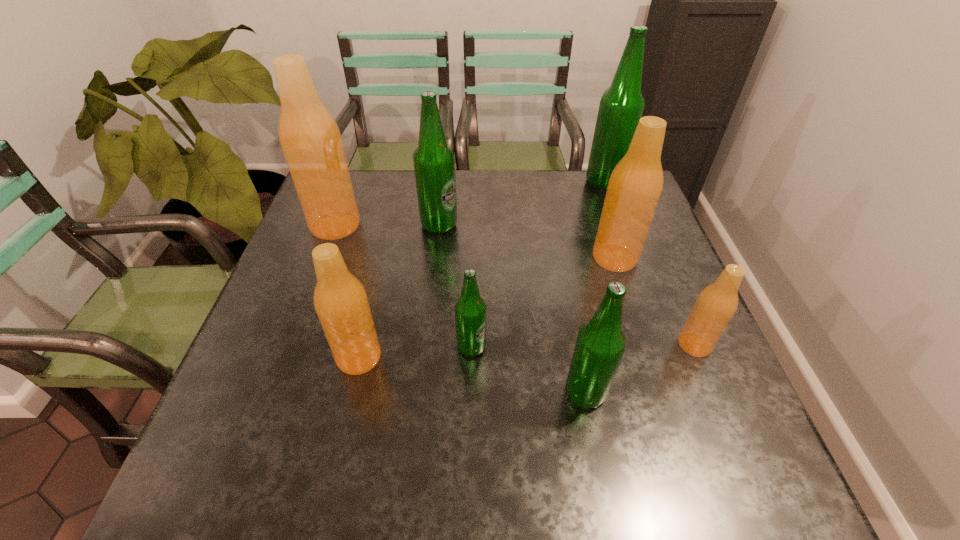
Where is `vacant region that satisfies the following two spatial constraints: 1. on the label of the farthest green beer bottle; 2. on the right side of the rightmost tan beer bottle`? This screenshot has height=540, width=960. vacant region that satisfies the following two spatial constraints: 1. on the label of the farthest green beer bottle; 2. on the right side of the rightmost tan beer bottle is located at coordinates (663, 345).

This screenshot has height=540, width=960. I want to click on vacant point that satisfies the following two spatial constraints: 1. on the label of the sixth object from right to left; 2. on the left side of the rightmost tan beer bottle, so click(426, 345).

This screenshot has width=960, height=540. What are the coordinates of `free region that satisfies the following two spatial constraints: 1. on the label of the leftmost green beer bottle; 2. on the front side of the seventh object from right to left` in the screenshot? It's located at (425, 357).

What are the coordinates of `vacant space that satisfies the following two spatial constraints: 1. on the front side of the rightmost tan beer bottle; 2. on the label of the second smallest green beer bottle` in the screenshot? It's located at (714, 393).

Find the location of a particular element. The height and width of the screenshot is (540, 960). vacant space that satisfies the following two spatial constraints: 1. on the label of the farthest green beer bottle; 2. on the right side of the rightmost tan beer bottle is located at coordinates (663, 345).